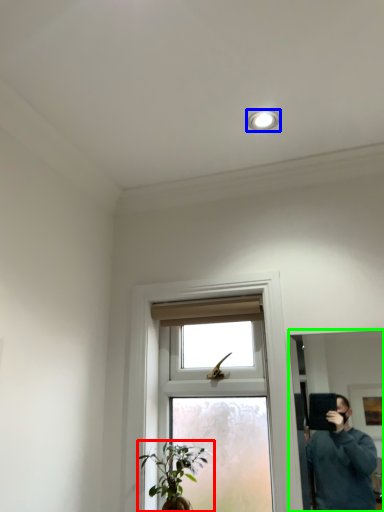
Question: Which object is positioned farthest from houseplant (highlighted by a red box)? Select from light fixture (highlighted by a blue box) and mirror (highlighted by a green box).

Choices:
 (A) light fixture
 (B) mirror

Answer: (B)